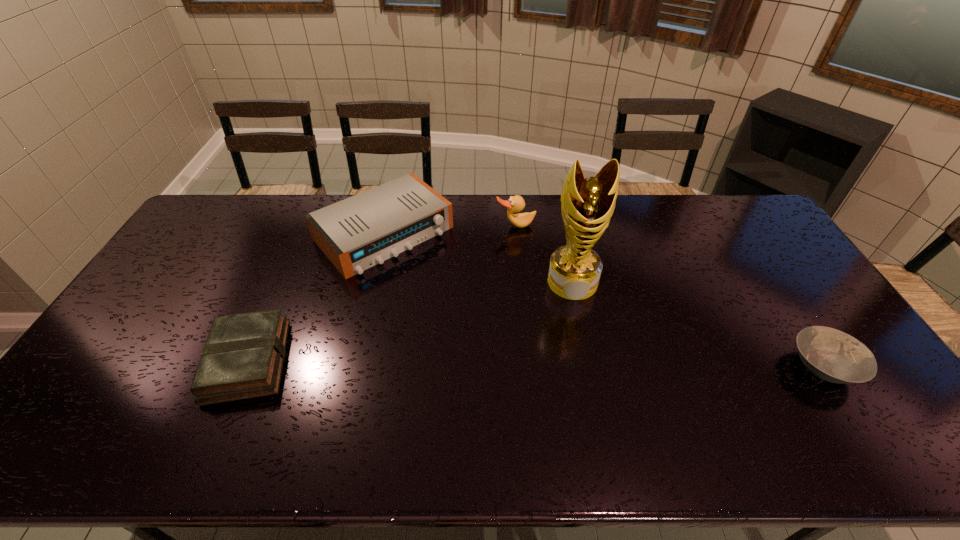
This screenshot has width=960, height=540. I want to click on free spot on the desktop that is between the book and the bowl and is positioned on the control panel of the third tallest object, so coord(516,363).

Where is `vacant space on the desktop that is between the book and the rightmost object and is positioned on the front-facing side of the second object from right to left`? vacant space on the desktop that is between the book and the rightmost object and is positioned on the front-facing side of the second object from right to left is located at coordinates (583, 364).

Find the location of a particular element. free space on the desktop that is between the book and the rightmost object and is positioned on the beak of the third object from right to left is located at coordinates (570, 364).